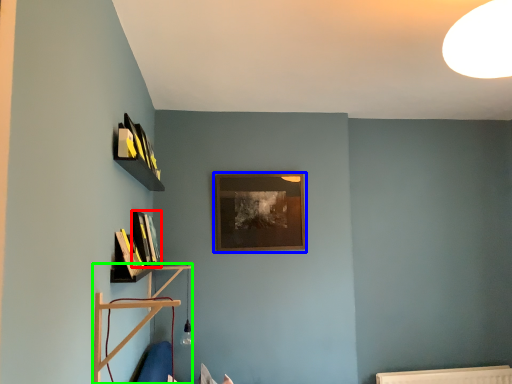
Question: Considering the real-world distances, which object is farthest from book (highlighted by a red box)? picture frame (highlighted by a blue box) or shelf (highlighted by a green box)?

Choices:
 (A) picture frame
 (B) shelf

Answer: (A)